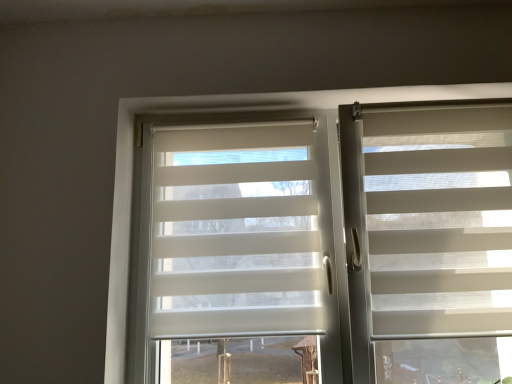
Where is `white translucent blinds at center`? This screenshot has width=512, height=384. white translucent blinds at center is located at coordinates (329, 230).

The width and height of the screenshot is (512, 384). What do you see at coordinates (236, 233) in the screenshot?
I see `white translucent roller shade at center` at bounding box center [236, 233].

Image resolution: width=512 pixels, height=384 pixels. I want to click on white translucent blinds at center, so click(329, 230).

Is white textured blind at right looking in the opposite direction of white translucent blinds at center?

Absolutely, white textured blind at right is directed away from white translucent blinds at center.

At what (x,y) coordinates should I click in order to perform the action: click on bay window below the white textured blind at right (from the image's perspective). Please return your answer as a coordinate pair (x, y). The width and height of the screenshot is (512, 384). Looking at the image, I should click on (329, 230).

From a real-world perspective, relative to white translucent blinds at center, is white textured blind at right vertically above or below?

Clearly, from a real-world perspective, white textured blind at right is above white translucent blinds at center.

Does white textured blind at right appear on the left side of white translucent blinds at center?

No.

Looking at this image, considering the relative sizes of white translucent blinds at center and white translucent roller shade at center in the image provided, is white translucent blinds at center shorter than white translucent roller shade at center?

Incorrect, the height of white translucent blinds at center does not fall short of that of white translucent roller shade at center.

Looking at this image, is white translucent blinds at center to the left or to the right of white translucent roller shade at center in the image?

white translucent blinds at center is to the right of white translucent roller shade at center.

Can you confirm if white translucent blinds at center is wider than white textured blind at right?

Yes.

What's the angular difference between white translucent blinds at center and white textured blind at right's facing directions?

white translucent blinds at center and white textured blind at right are facing 0.000393 degrees away from each other.

Is white translucent blinds at center oriented towards white textured blind at right?

Yes, white translucent blinds at center is oriented towards white textured blind at right.

Considering the relative positions of white translucent blinds at center and white textured blind at right in the image provided, is white translucent blinds at center to the right of white textured blind at right from the viewer's perspective?

No, white translucent blinds at center is not to the right of white textured blind at right.

Is white translucent roller shade at center touching white translucent blinds at center?

Yes, white translucent roller shade at center is touching white translucent blinds at center.

Is white translucent roller shade at center aimed at white translucent blinds at center?

Yes, white translucent roller shade at center faces towards white translucent blinds at center.

Which object is further away from the camera taking this photo, white translucent roller shade at center or white translucent blinds at center?

white translucent roller shade at center is further away from the camera.

Is white textured blind at right positioned before white translucent roller shade at center?

Yes, it is in front of white translucent roller shade at center.

From the image's perspective, relative to white translucent roller shade at center, is white textured blind at right above or below?

From the image's perspective, white textured blind at right appears above white translucent roller shade at center.

You are a GUI agent. You are given a task and a screenshot of the screen. Output one action in this format:
    pyautogui.click(x=<x>, y=<y>)
    Task: Click on the glass door behind the white textured blind at right
    The width and height of the screenshot is (512, 384).
    Given the screenshot: What is the action you would take?
    pyautogui.click(x=236, y=233)

Are white textured blind at right and white translucent roller shade at center making contact?

There is a gap between white textured blind at right and white translucent roller shade at center.

Can you confirm if white translucent roller shade at center is wider than white textured blind at right?

In fact, white translucent roller shade at center might be narrower than white textured blind at right.

Locate an element on the screen. window blind lying above the white translucent roller shade at center (from the image's perspective) is located at coordinates point(428,239).

Which of these two, white translucent roller shade at center or white textured blind at right, stands taller?

Standing taller between the two is white textured blind at right.

Does white translucent roller shade at center appear on the right side of white textured blind at right?

In fact, white translucent roller shade at center is to the left of white textured blind at right.

In order to click on bay window below the white textured blind at right (from a real-world perspective) in this screenshot , I will do `click(329, 230)`.

This screenshot has height=384, width=512. I want to click on bay window in front of the white translucent roller shade at center, so click(x=329, y=230).

Which object lies nearer to the anchor point white textured blind at right, white translucent blinds at center or white translucent roller shade at center?

white translucent blinds at center lies closer to white textured blind at right than the other object.

From the image, which object appears to be nearer to white translucent blinds at center, white translucent roller shade at center or white textured blind at right?

Among the two, white translucent roller shade at center is located nearer to white translucent blinds at center.

Looking at the image, which one is located closer to white textured blind at right, white translucent roller shade at center or white translucent blinds at center?

Among the two, white translucent blinds at center is located nearer to white textured blind at right.

Based on their spatial positions, is white textured blind at right or white translucent roller shade at center closer to white translucent blinds at center?

Among the two, white translucent roller shade at center is located nearer to white translucent blinds at center.

Considering their positions, is white textured blind at right positioned further to white translucent roller shade at center than white translucent blinds at center?

Among the two, white textured blind at right is located further to white translucent roller shade at center.

Which object lies nearer to the anchor point white translucent roller shade at center, white translucent blinds at center or white textured blind at right?

Among the two, white translucent blinds at center is located nearer to white translucent roller shade at center.

The image size is (512, 384). In order to click on bay window between white translucent roller shade at center and white textured blind at right in this screenshot , I will do tap(329, 230).